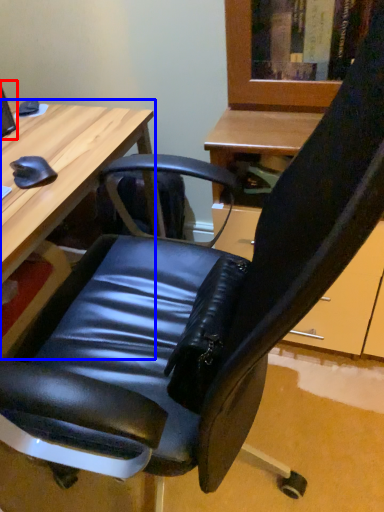
Question: Which object appears closest to the camera in this image, computer monitor (highlighted by a red box) or desk (highlighted by a blue box)?

Choices:
 (A) computer monitor
 (B) desk

Answer: (B)